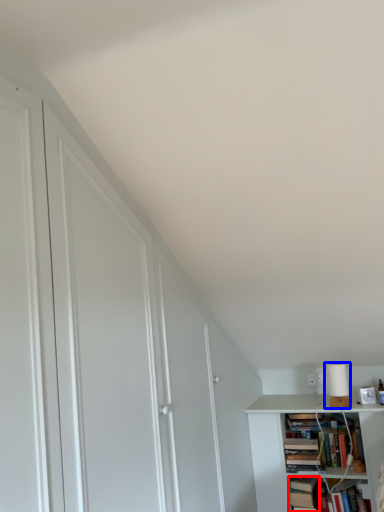
Question: Among these objects, which one is farthest to the camera, book (highlighted by a red box) or lamp (highlighted by a blue box)?

Choices:
 (A) book
 (B) lamp

Answer: (B)